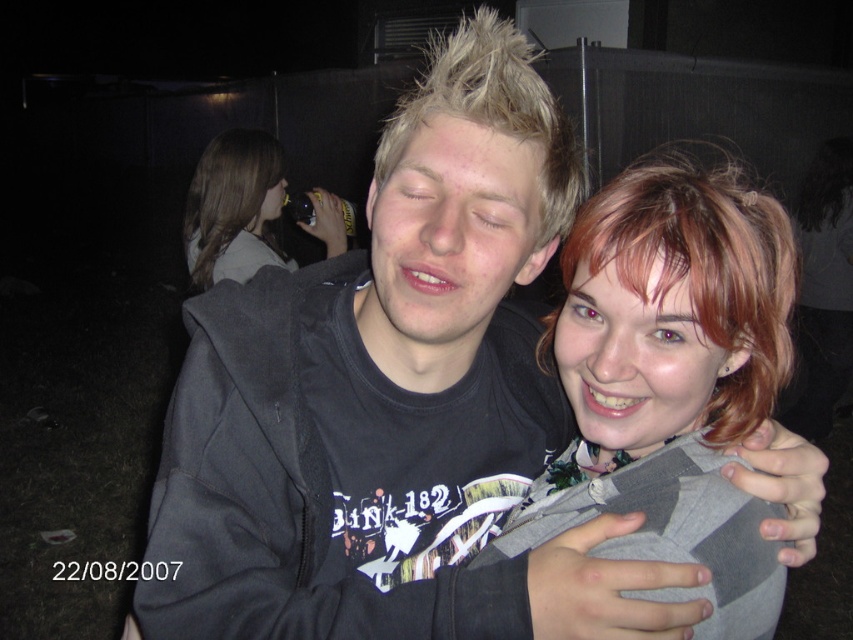
Question: In this image, where is matte gray hoodie at center located relative to brown hair at upper left?

Choices:
 (A) left
 (B) right

Answer: (B)

Question: Is matte gray hoodie at center thinner than brown hair at upper left?

Choices:
 (A) yes
 (B) no

Answer: (A)

Question: Can you confirm if matte gray hoodie at center is wider than brown hair at upper left?

Choices:
 (A) yes
 (B) no

Answer: (B)

Question: Which point appears closest to the camera in this image?

Choices:
 (A) (677, 531)
 (B) (184, 225)

Answer: (A)

Question: Which object appears closest to the camera in this image?

Choices:
 (A) matte gray hoodie at center
 (B) brown hair at upper left

Answer: (A)